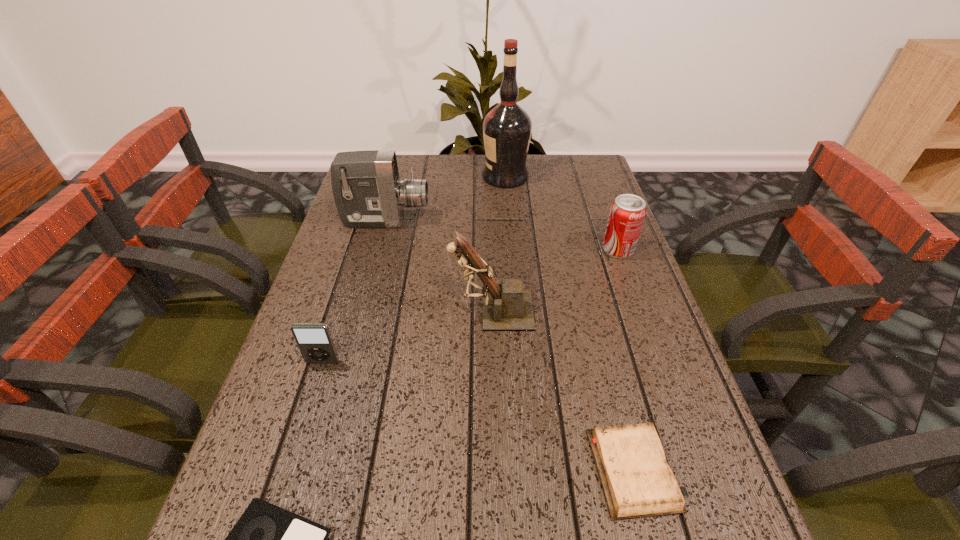
Image resolution: width=960 pixels, height=540 pixels. In order to click on camcorder situated at the left edge in this screenshot , I will do point(368,193).

Identify the location of iPod located at the left edge. (315, 343).

This screenshot has height=540, width=960. Find the location of `soda can that is positioned at the right edge`. soda can that is positioned at the right edge is located at coordinates (627, 213).

Where is `diary that is positioned at the right edge`? The image size is (960, 540). diary that is positioned at the right edge is located at coordinates (637, 481).

Where is `vacant space at the far edge`? vacant space at the far edge is located at coordinates (531, 174).

Locate an element on the screen. blank space at the left edge is located at coordinates (328, 492).

In the image, there is a desktop. Where is `vacant area at the right edge`? This screenshot has height=540, width=960. vacant area at the right edge is located at coordinates (635, 262).

Find the location of a particular element. The height and width of the screenshot is (540, 960). free area in between the camcorder and the second shortest object is located at coordinates (511, 345).

At what (x,y) coordinates should I click in order to perform the action: click on free space that is in between the camcorder and the sixth tallest object. Please return your answer as a coordinate pair (x, y). Looking at the image, I should click on (511, 345).

You are a GUI agent. You are given a task and a screenshot of the screen. Output one action in this format:
    pyautogui.click(x=<x>, y=<y>)
    Task: Click on the vacant point located between the farther iPod and the fourth shortest object
    
    Given the screenshot: What is the action you would take?
    pyautogui.click(x=470, y=306)